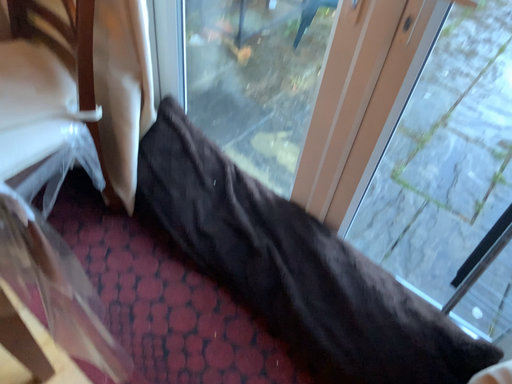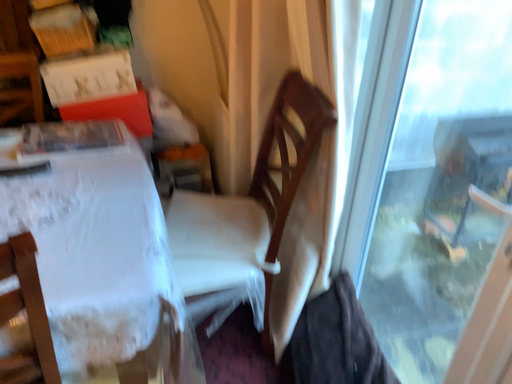
Question: Which way did the camera rotate in the video?

Choices:
 (A) rotated left
 (B) rotated right

Answer: (A)